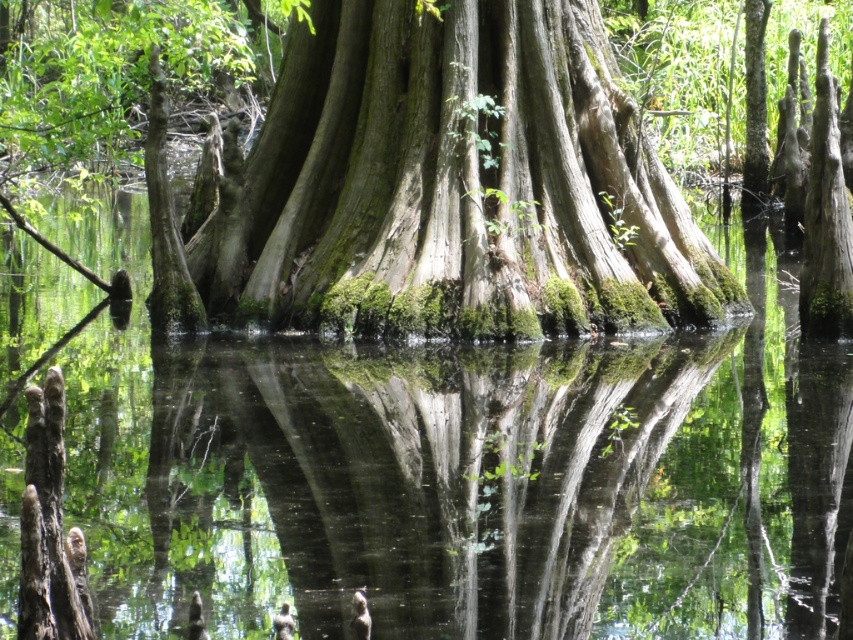
Image resolution: width=853 pixels, height=640 pixels. Describe the element at coordinates (415, 474) in the screenshot. I see `green mossy tree roots at center` at that location.

Describe the element at coordinates (415, 474) in the screenshot. I see `green mossy tree roots at center` at that location.

The width and height of the screenshot is (853, 640). I want to click on green mossy tree roots at center, so click(415, 474).

Is point (519, 365) in front of point (334, 397)?

No.

The image size is (853, 640). Describe the element at coordinates (459, 470) in the screenshot. I see `green mossy water at center` at that location.

The image size is (853, 640). Find the location of `green mossy water at center`. green mossy water at center is located at coordinates (459, 470).

Is point (90, 572) behind point (585, 160)?

No, (90, 572) is in front of (585, 160).

Who is higher up, green mossy water at center or green mossy bark at center?

green mossy bark at center is higher up.

Image resolution: width=853 pixels, height=640 pixels. Describe the element at coordinates (459, 470) in the screenshot. I see `green mossy water at center` at that location.

Identify the location of green mossy water at center. (459, 470).